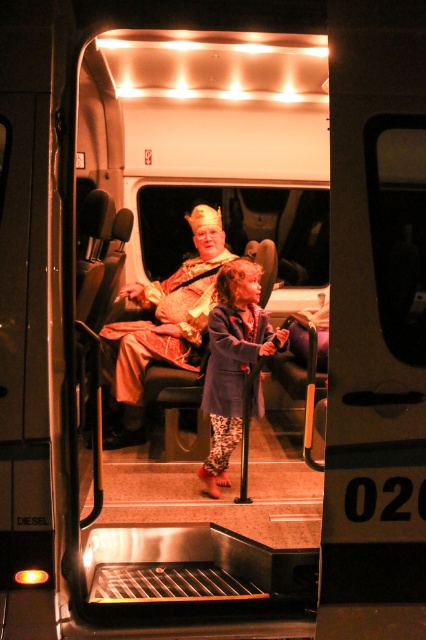
Between gold metallic crown at center and blue denim jacket at center, which one appears on the right side from the viewer's perspective?

Answer: From the viewer's perspective, blue denim jacket at center appears more on the right side.

Can you confirm if gold metallic crown at center is positioned to the left of blue denim jacket at center?

Correct, you'll find gold metallic crown at center to the left of blue denim jacket at center.

What do you see at coordinates (164, 323) in the screenshot?
I see `gold metallic crown at center` at bounding box center [164, 323].

Identify the location of gold metallic crown at center. (164, 323).